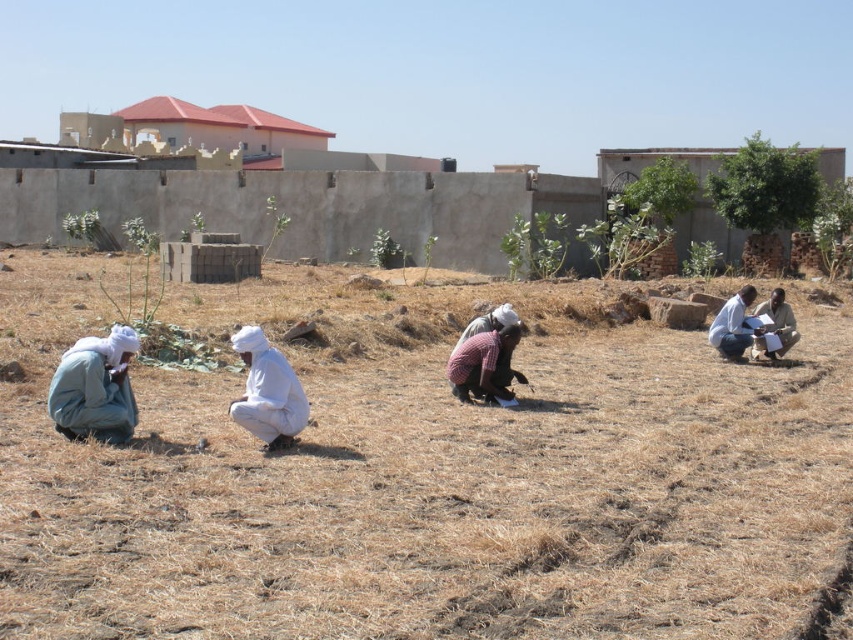
Question: Does brown dry grass at center appear over reddish-brown fabric at center?

Choices:
 (A) yes
 (B) no

Answer: (A)

Question: Can you confirm if brown dry grass at center is positioned below light brown fabric at right?

Choices:
 (A) yes
 (B) no

Answer: (A)

Question: Which object is the farthest from the brown dry grass at center?

Choices:
 (A) light gray fabric at left
 (B) white cotton turban at center
 (C) light brown fabric at right
 (D) white cloth at right

Answer: (D)

Question: Which point appears closest to the camera in this image?

Choices:
 (A) (474, 388)
 (B) (740, 339)
 (C) (73, 355)

Answer: (C)

Question: Which point is farther to the camera?

Choices:
 (A) (749, 326)
 (B) (788, 337)
 (C) (506, 369)

Answer: (B)

Question: Is brown dry grass at center to the left of white cotton turban at center from the viewer's perspective?

Choices:
 (A) yes
 (B) no

Answer: (A)